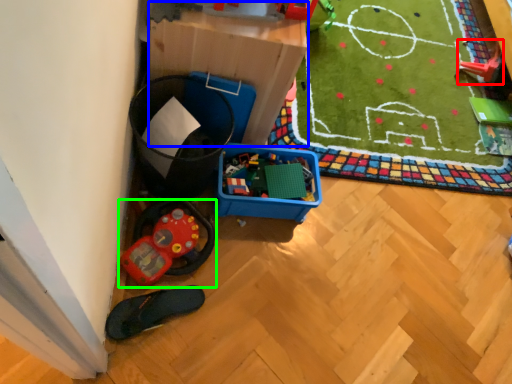
Question: Which object is positioned closest to toy (highlighted by a red box)? Select from storage box (highlighted by a blue box) and toy (highlighted by a green box).

Choices:
 (A) storage box
 (B) toy

Answer: (A)